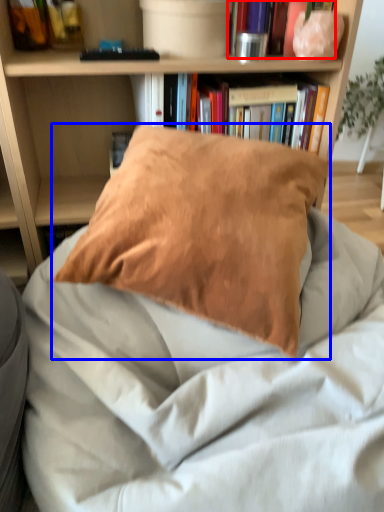
Question: Which object appears closest to the camera in this image, book (highlighted by a red box) or pillow (highlighted by a blue box)?

Choices:
 (A) book
 (B) pillow

Answer: (B)